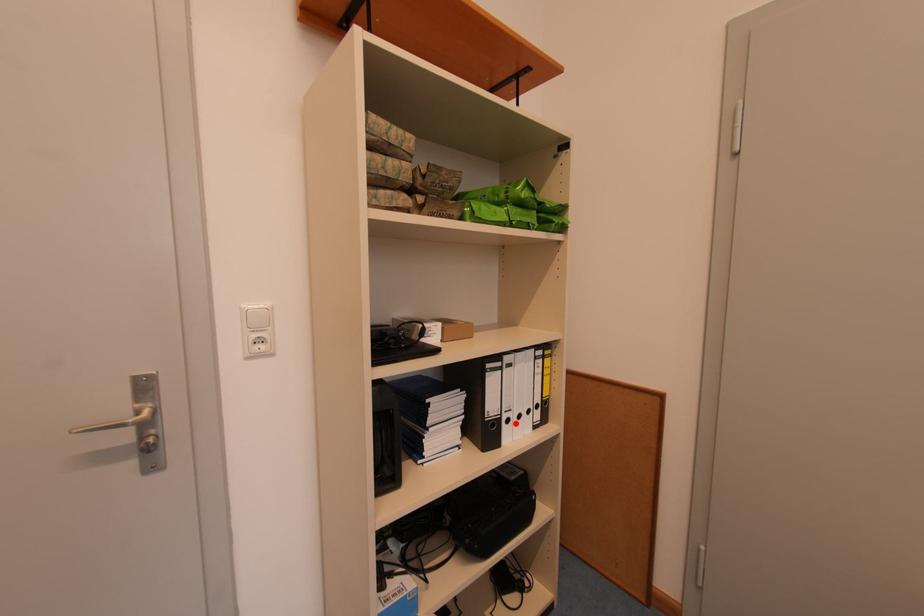
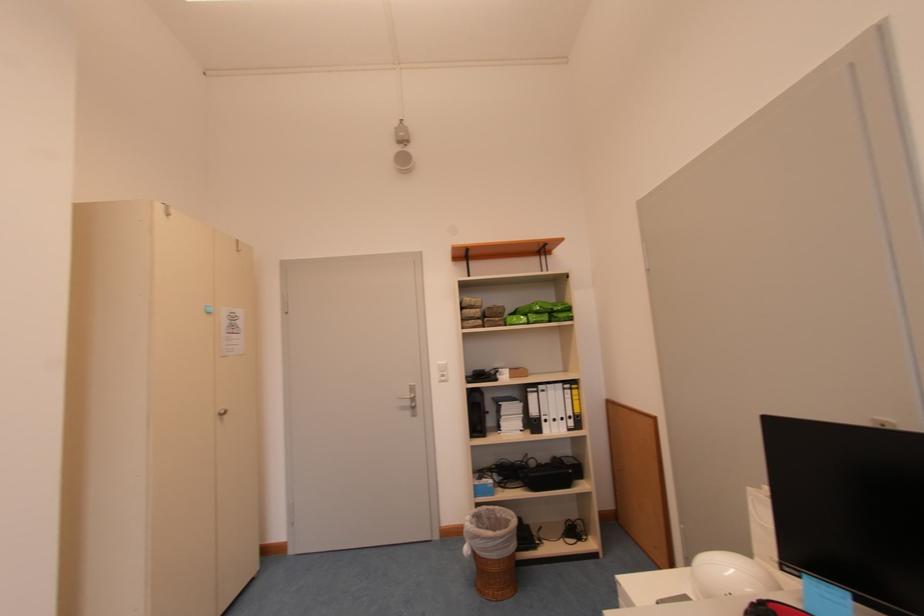
Find the pixel in the second image that matches the highlighted location in the first image.

(553, 424)